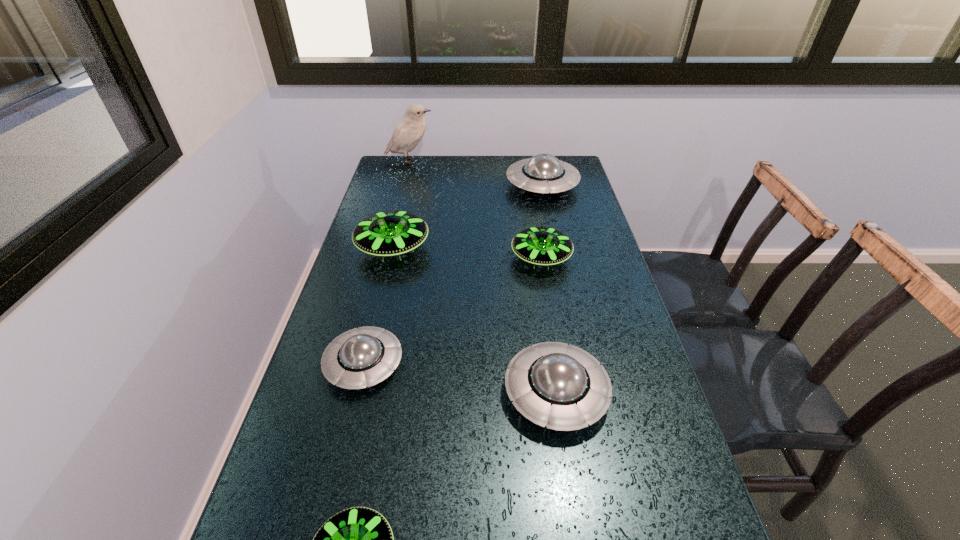
In the image, there is a desktop. Where is `blank space at the left edge`? The height and width of the screenshot is (540, 960). blank space at the left edge is located at coordinates (371, 288).

Image resolution: width=960 pixels, height=540 pixels. In the image, there is a desktop. What are the coordinates of `vacant region at the right edge` in the screenshot? It's located at (626, 356).

This screenshot has width=960, height=540. I want to click on unoccupied area between the second biggest gray saucer and the white bird, so click(x=483, y=277).

I want to click on free space between the rightmost green saucer and the farthest object, so click(475, 210).

The image size is (960, 540). Identify the location of vacant area that lies between the bird and the smallest gray saucer. (387, 262).

Find the location of a particular element. free space between the second biggest green saucer and the bird is located at coordinates (475, 210).

I want to click on vacant area that lies between the leftmost gray saucer and the biggest green saucer, so click(378, 306).

I want to click on free spot between the biggest gray saucer and the leftmost gray saucer, so click(453, 275).

Where is `free spot between the biggest green saucer and the smallest gray saucer`? The image size is (960, 540). free spot between the biggest green saucer and the smallest gray saucer is located at coordinates (378, 306).

Locate an element on the screen. free space that is in between the biggest green saucer and the second farthest object is located at coordinates (468, 217).